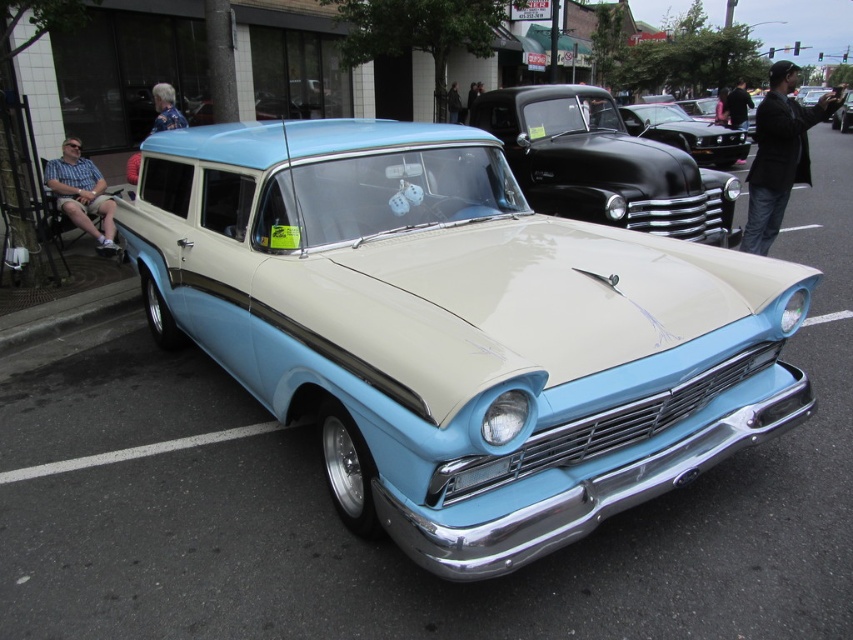
Does shiny black car at center appear on the right side of light blue metallic car at center?

Incorrect, shiny black car at center is not on the right side of light blue metallic car at center.

From the picture: Does shiny black car at center have a lesser height compared to light blue metallic car at center?

Indeed, shiny black car at center has a lesser height compared to light blue metallic car at center.

This screenshot has width=853, height=640. Identify the location of shiny black car at center. (686, 132).

Image resolution: width=853 pixels, height=640 pixels. Describe the element at coordinates (604, 164) in the screenshot. I see `glossy black car at center` at that location.

Does glossy black car at center have a lesser width compared to shiny black car at center?

No.

Where is `glossy black car at center`? The width and height of the screenshot is (853, 640). glossy black car at center is located at coordinates (604, 164).

Which is above, glossy black car at center or light blue metallic car at center?

Positioned higher is light blue metallic car at center.

Can you confirm if glossy black car at center is shorter than light blue metallic car at center?

Yes.

Which is in front, point (737, 179) or point (833, 124)?

Point (737, 179) is more forward.

You are a GUI agent. You are given a task and a screenshot of the screen. Output one action in this format:
    pyautogui.click(x=<x>, y=<y>)
    Task: Click on the glossy black car at center
    The image size is (853, 640).
    Given the screenshot: What is the action you would take?
    pyautogui.click(x=604, y=164)